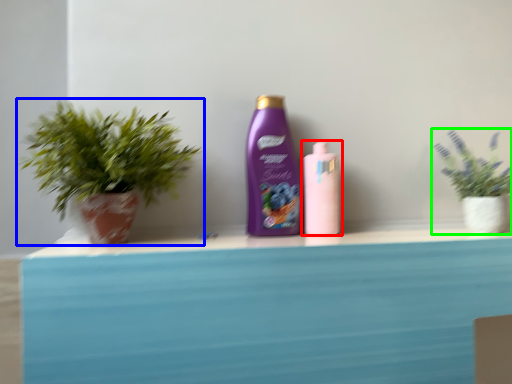
Question: Estimate the real-world distances between objects in this image. Which object is closer to bottle (highlighted by a red box), houseplant (highlighted by a blue box) or houseplant (highlighted by a green box)?

Choices:
 (A) houseplant
 (B) houseplant

Answer: (B)